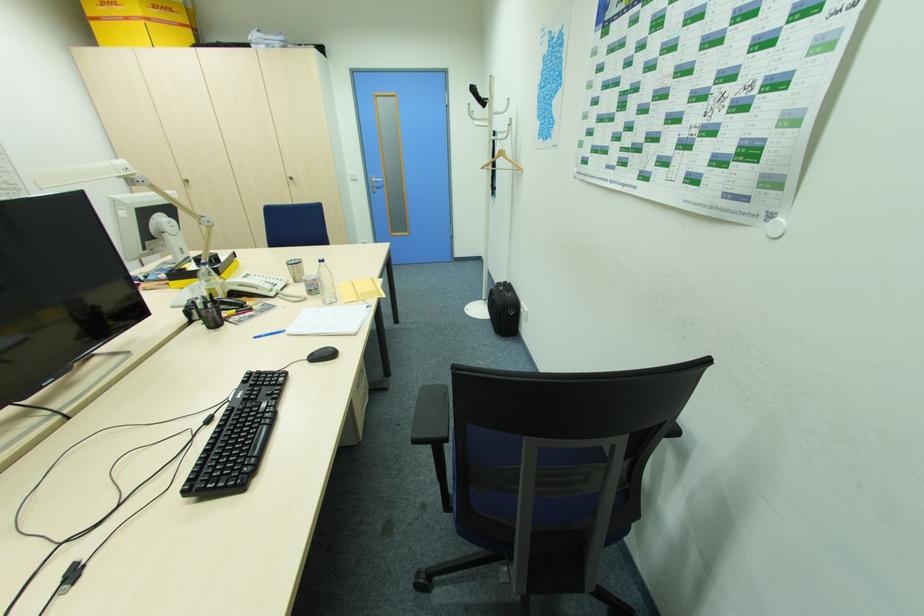
Where is `clear water bottle`? clear water bottle is located at coordinates (325, 283).